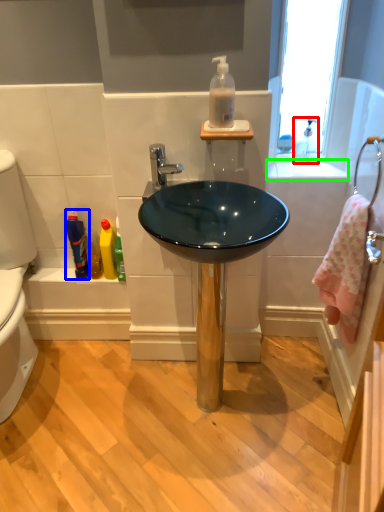
Question: Which object is positioned closest to faucet (highlighted by a red box)? Select from mouthwash (highlighted by a blue box) and counter top (highlighted by a green box).

Choices:
 (A) mouthwash
 (B) counter top

Answer: (B)